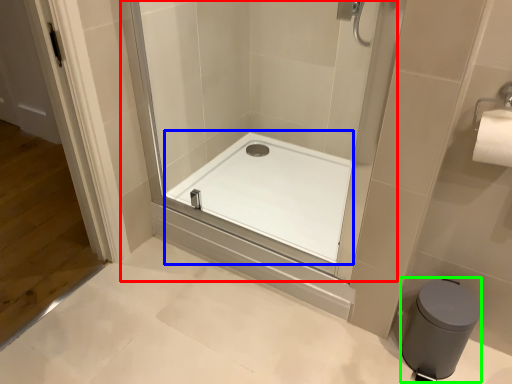
Question: Estimate the real-world distances between objects in this image. Which object is closer to shower door (highlighted by a red box), bath (highlighted by a blue box) or bidet (highlighted by a green box)?

Choices:
 (A) bath
 (B) bidet

Answer: (A)